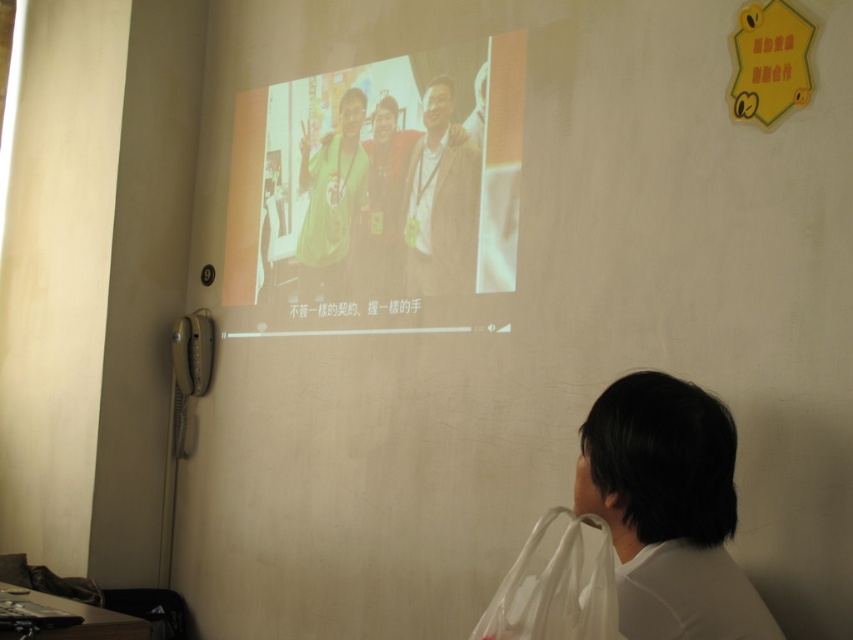
Which is more to the left, matte plastic screen at upper center or matte yellow shirt at center?

matte plastic screen at upper center

Who is more forward, (498, 173) or (358, 275)?

Point (498, 173) is more forward.

Image resolution: width=853 pixels, height=640 pixels. Identify the location of matte plastic screen at upper center. (376, 184).

Is matte brown jacket at center behind green jersey at center?

No, matte brown jacket at center is in front of green jersey at center.

Which is above, matte brown jacket at center or green jersey at center?

green jersey at center

The image size is (853, 640). Describe the element at coordinates (440, 200) in the screenshot. I see `matte brown jacket at center` at that location.

The height and width of the screenshot is (640, 853). I want to click on matte brown jacket at center, so click(x=440, y=200).

Can you confirm if matte plastic screen at upper center is smaller than white plastic bag at lower right?

No.

Does matte plastic screen at upper center have a larger size compared to white plastic bag at lower right?

Indeed, matte plastic screen at upper center has a larger size compared to white plastic bag at lower right.

At what (x,y) coordinates should I click in order to perform the action: click on matte plastic screen at upper center. Please return your answer as a coordinate pair (x, y). This screenshot has height=640, width=853. Looking at the image, I should click on 376,184.